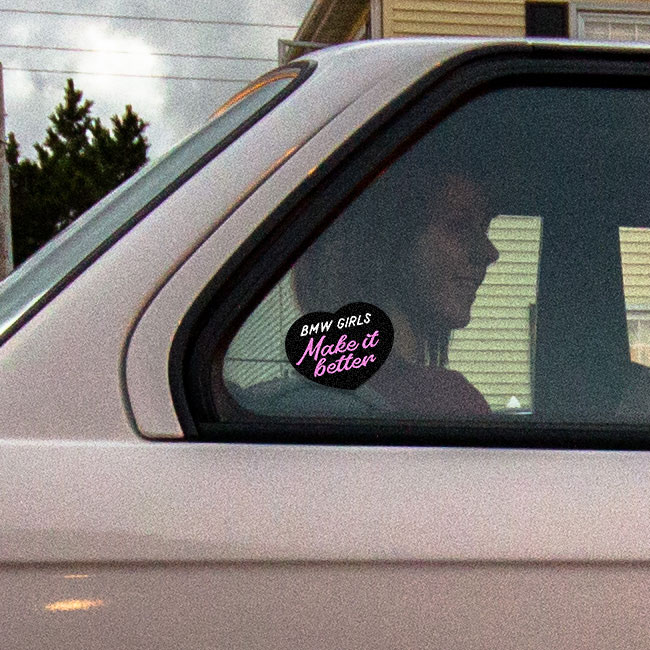
I want to click on window shutter, so pyautogui.click(x=545, y=12).